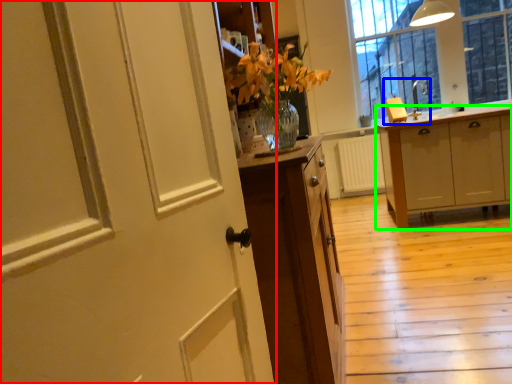
Question: Which is nearer to the door (highlighted by a red box)? sink (highlighted by a blue box) or cabinetry (highlighted by a green box).

Choices:
 (A) sink
 (B) cabinetry

Answer: (B)